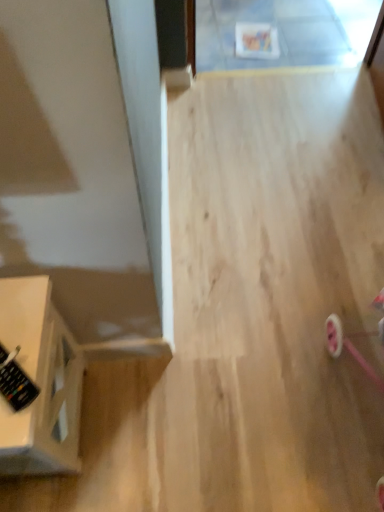
Question: From a real-world perspective, does black plastic remote at lower left stand above white glossy side table at left?

Choices:
 (A) yes
 (B) no

Answer: (A)

Question: Is black plastic remote at lower left next to white glossy side table at left and touching it?

Choices:
 (A) no
 (B) yes

Answer: (A)

Question: Is black plastic remote at lower left not within white glossy side table at left?

Choices:
 (A) no
 (B) yes

Answer: (B)

Question: Is black plastic remote at lower left behind white glossy side table at left?

Choices:
 (A) yes
 (B) no

Answer: (A)

Question: From the image's perspective, is black plastic remote at lower left above white glossy side table at left?

Choices:
 (A) no
 (B) yes

Answer: (B)

Question: Would you say black plastic remote at lower left contains white glossy side table at left?

Choices:
 (A) no
 (B) yes

Answer: (A)

Question: Does white glossy side table at left have a lesser width compared to black plastic remote at lower left?

Choices:
 (A) yes
 (B) no

Answer: (B)

Question: Considering the relative sizes of white glossy side table at left and black plastic remote at lower left in the image provided, is white glossy side table at left wider than black plastic remote at lower left?

Choices:
 (A) no
 (B) yes

Answer: (B)

Question: From a real-world perspective, is white glossy side table at left positioned over black plastic remote at lower left based on gravity?

Choices:
 (A) no
 (B) yes

Answer: (A)

Question: Considering the relative positions of white glossy side table at left and black plastic remote at lower left in the image provided, is white glossy side table at left behind black plastic remote at lower left?

Choices:
 (A) no
 (B) yes

Answer: (A)

Question: From the image's perspective, does white glossy side table at left appear lower than black plastic remote at lower left?

Choices:
 (A) no
 (B) yes

Answer: (B)

Question: Is black plastic remote at lower left completely or partially inside white glossy side table at left?

Choices:
 (A) yes
 (B) no

Answer: (B)

Question: In the image, is black plastic remote at lower left on the left side or the right side of white glossy side table at left?

Choices:
 (A) right
 (B) left

Answer: (A)